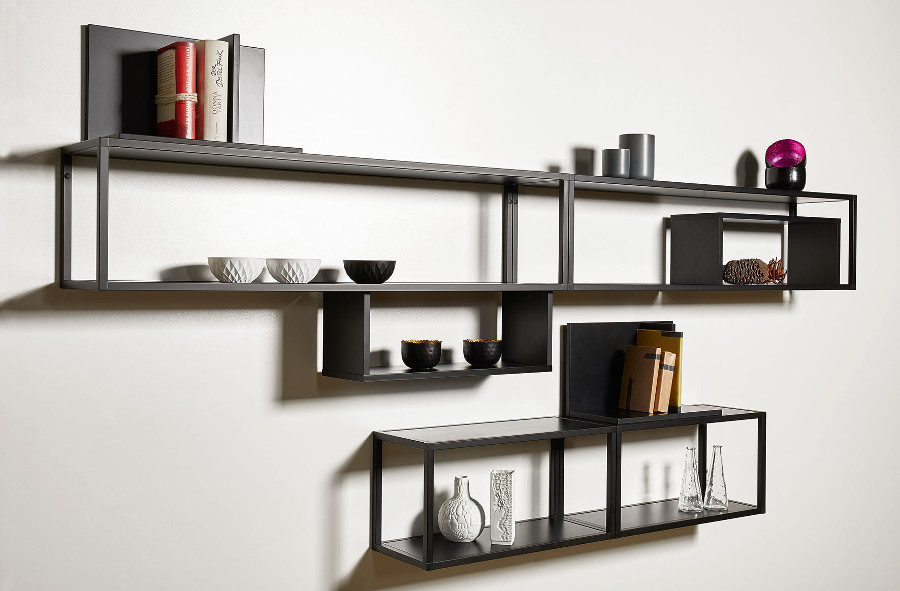
At what (x,y) coordinates should I click in order to perform the action: click on shelves. Please return your answer as a coordinate pair (x, y). The width and height of the screenshot is (900, 591). Looking at the image, I should click on (542, 540), (519, 436), (411, 368), (444, 285), (456, 173).